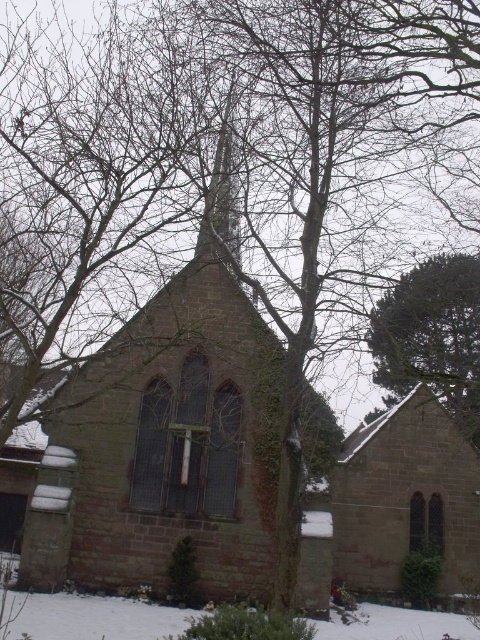
Question: Is brown stone chapel at center below green textured pine tree at upper right?

Choices:
 (A) yes
 (B) no

Answer: (A)

Question: Does green textured pine tree at upper right lie in front of smooth stone spire at center?

Choices:
 (A) yes
 (B) no

Answer: (B)

Question: Which object appears closest to the camera in this image?

Choices:
 (A) green textured pine tree at upper right
 (B) brown stone chapel at center
 (C) smooth stone spire at center

Answer: (B)

Question: Can you confirm if brown stone chapel at center is positioned to the left of smooth stone spire at center?

Choices:
 (A) yes
 (B) no

Answer: (A)

Question: Among these points, which one is nearest to the camera?

Choices:
 (A) (232, 234)
 (B) (305, 609)

Answer: (B)

Question: Based on their relative distances, which object is farther from the brown stone chapel at center?

Choices:
 (A) smooth stone spire at center
 (B) green textured pine tree at upper right

Answer: (B)